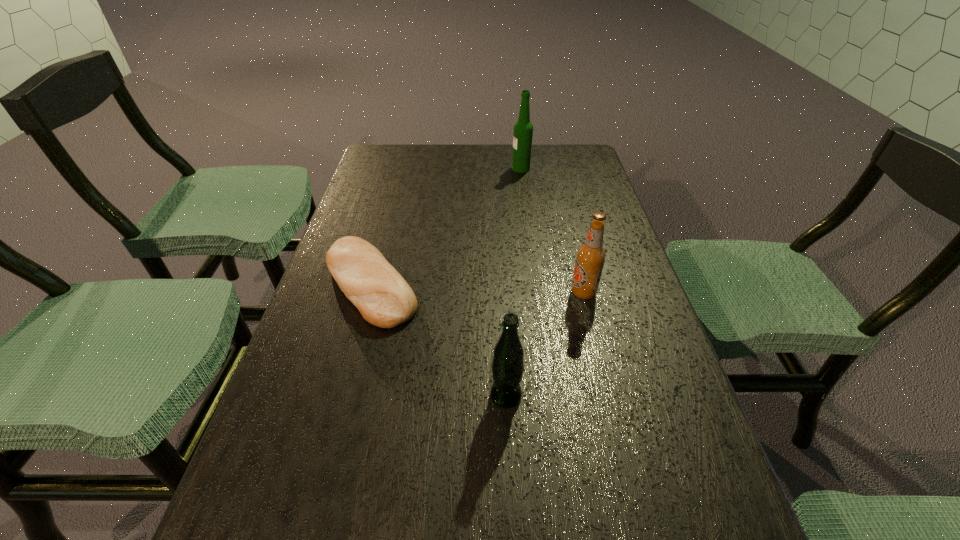
Find the location of `free space at the left edge`. free space at the left edge is located at coordinates (374, 226).

Find the location of a particular element. This screenshot has height=540, width=960. vacant space at the right edge of the desktop is located at coordinates (650, 519).

The width and height of the screenshot is (960, 540). I want to click on vacant space at the far left corner, so point(404,158).

Where is `free region at the far right corner of the desktop`? free region at the far right corner of the desktop is located at coordinates click(x=585, y=152).

Where is `vacant space in between the rightmost beer bottle and the farthest object`? The height and width of the screenshot is (540, 960). vacant space in between the rightmost beer bottle and the farthest object is located at coordinates (552, 231).

The image size is (960, 540). Identify the location of free spot between the rightmost object and the farthest beer bottle. (552, 231).

You are a GUI agent. You are given a task and a screenshot of the screen. Output one action in this format:
    pyautogui.click(x=<x>, y=<y>)
    Task: Click on the free spot between the rightmost object and the farthest beer bottle
    This screenshot has width=960, height=540.
    Given the screenshot: What is the action you would take?
    pyautogui.click(x=552, y=231)

The image size is (960, 540). Find the location of `vacant point located between the second farthest beer bottle and the farthest beer bottle`. vacant point located between the second farthest beer bottle and the farthest beer bottle is located at coordinates (552, 231).

Where is `vacant area that lies between the rightmost beer bottle and the leftmost beer bottle`? The image size is (960, 540). vacant area that lies between the rightmost beer bottle and the leftmost beer bottle is located at coordinates (544, 344).

Where is `vacant space in between the nearest beer bottle and the rightmost object`? This screenshot has width=960, height=540. vacant space in between the nearest beer bottle and the rightmost object is located at coordinates (544, 344).